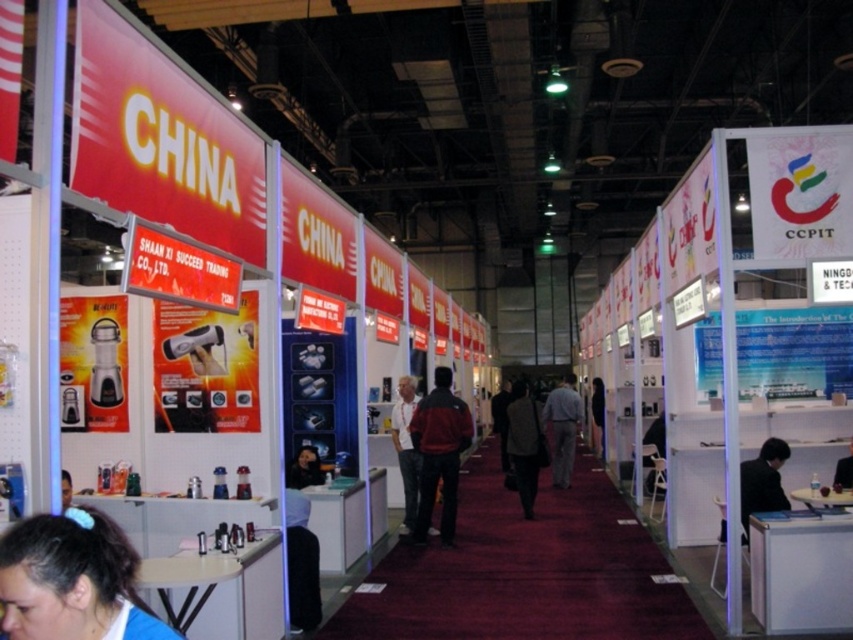
Measure the distance between gray fabric pants at center and dark blue shirt at center.

5.11 meters

Is point (548, 426) farther from camera compared to point (834, 490)?

Yes.

Who is more distant from viewer, (566, 380) or (848, 468)?

The point (566, 380) is more distant.

Find the location of a particular element. gray fabric pants at center is located at coordinates (561, 428).

Does point (595, 396) come behind point (845, 465)?

Yes, it is behind point (845, 465).

Does dark brown leather jacket at center appear on the right side of dark blue shirt at center?

Incorrect, dark brown leather jacket at center is not on the right side of dark blue shirt at center.

Find the location of a particular element. This screenshot has width=853, height=640. dark brown leather jacket at center is located at coordinates (598, 410).

Does red jacket at center lie behind gray fabric pants at center?

No.

Between point (434, 442) and point (547, 401), which one is positioned in front?

Point (434, 442) is in front.

Describe the element at coordinates (439, 452) in the screenshot. This screenshot has height=640, width=853. I see `red jacket at center` at that location.

This screenshot has width=853, height=640. In order to click on red jacket at center in this screenshot , I will do `click(439, 452)`.